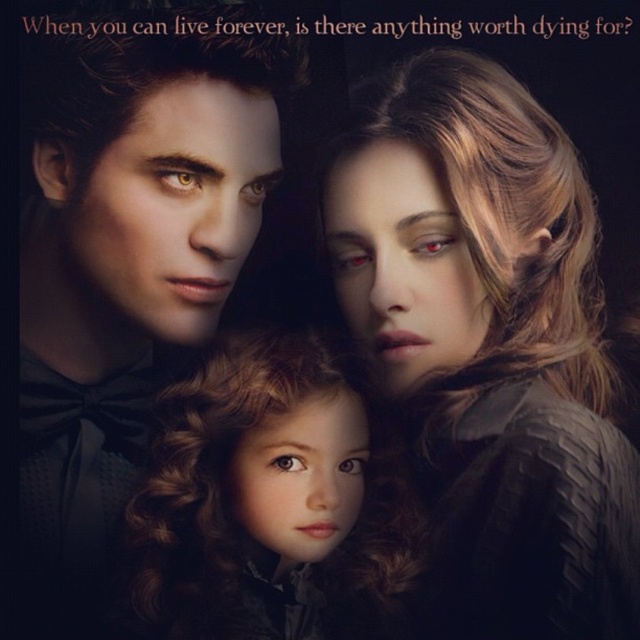
Does satin black dress at center come in front of matte black suit at left?

Yes, satin black dress at center is in front of matte black suit at left.

Between satin black dress at center and matte black suit at left, which one has more height?

matte black suit at left is taller.

Is point (362, 96) more distant than point (113, 468)?

That is False.

You are a GUI agent. You are given a task and a screenshot of the screen. Output one action in this format:
    pyautogui.click(x=<x>, y=<y>)
    Task: Click on the satin black dress at center
    
    Given the screenshot: What is the action you would take?
    pyautogui.click(x=490, y=346)

Can you confirm if matte black suit at left is smaller than curly brown hair doll at center?

No.

Between point (285, 51) and point (333, 369), which one is positioned behind?

Positioned behind is point (285, 51).

At what (x,y) coordinates should I click in order to perform the action: click on matte black suit at left. Please return your answer as a coordinate pair (x, y). Looking at the image, I should click on (129, 253).

Who is taller, satin black dress at center or curly brown hair doll at center?

satin black dress at center

Does satin black dress at center appear on the left side of curly brown hair doll at center?

Incorrect, satin black dress at center is not on the left side of curly brown hair doll at center.

This screenshot has width=640, height=640. Describe the element at coordinates (490, 346) in the screenshot. I see `satin black dress at center` at that location.

Identify the location of satin black dress at center. (490, 346).